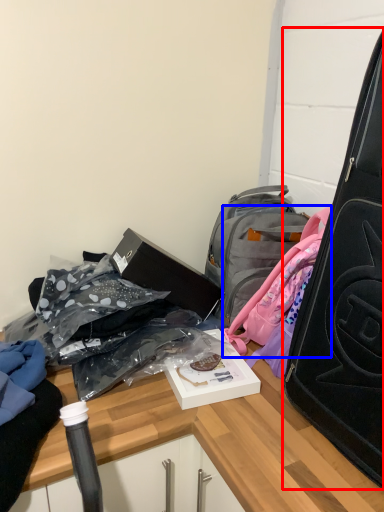
Question: Which point is closer to the camera, suitcase (highlighted by a red box) or backpack (highlighted by a blue box)?

Choices:
 (A) suitcase
 (B) backpack

Answer: (A)